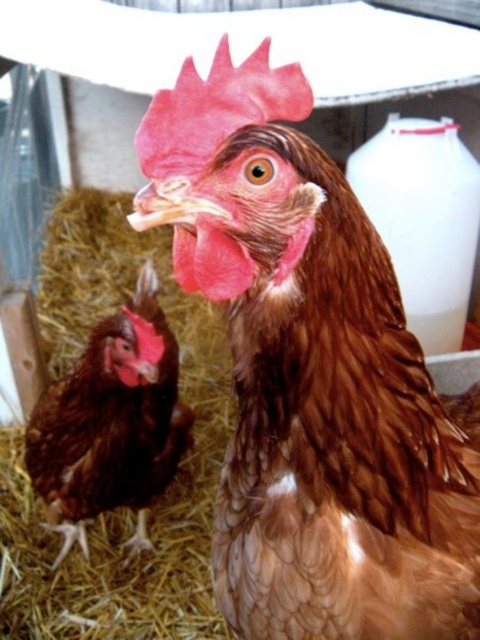
You are a farmer checking on your chickens in the barn. You notice two chickens, the brown feathered chicken at center and the brown feathered chicken at lower left. Which chicken is positioned higher in the image?

The brown feathered chicken at center is positioned higher in the image as it is located above the brown feathered chicken at lower left.

You are standing in a barn and see two chickens. One is the brown feathered chicken at center and the other is the brown feathered chicken at lower left. Which chicken is positioned to the right of the other?

The brown feathered chicken at center is positioned to the right of the brown feathered chicken at lower left.